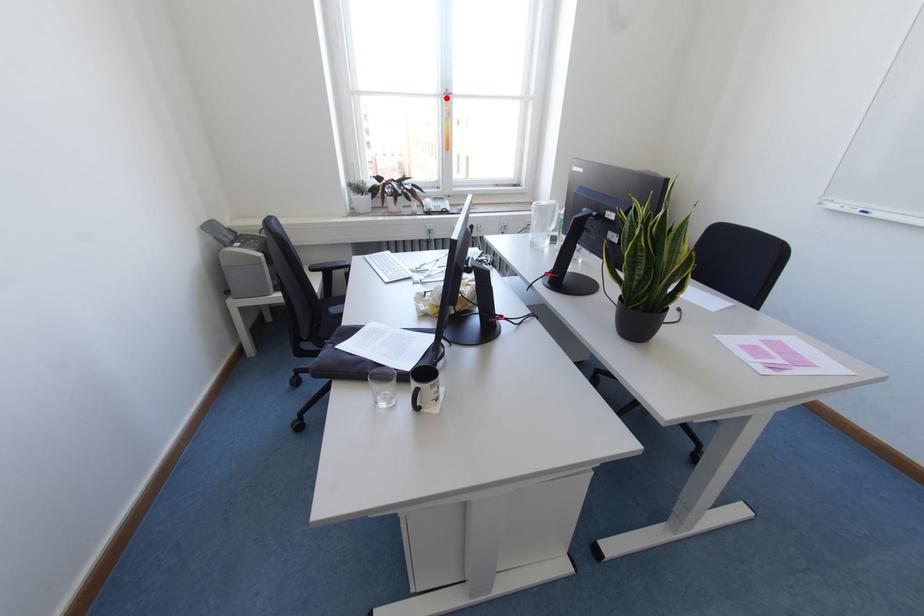
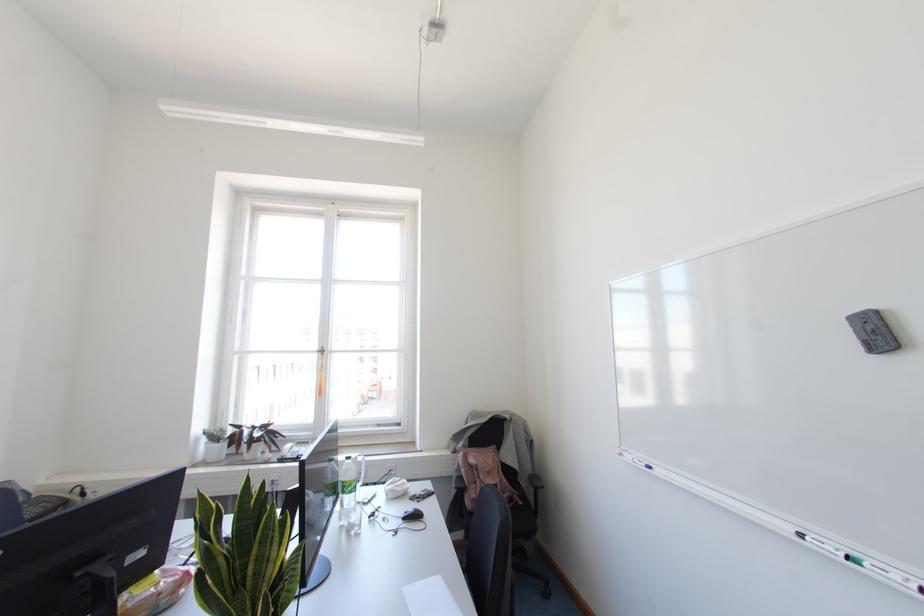
Where in the second image is the point corresponding to the highlighted location from the first image?

(322, 353)